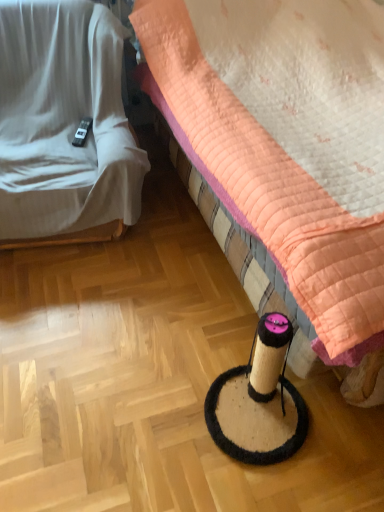
This screenshot has width=384, height=512. What do you see at coordinates (287, 137) in the screenshot?
I see `quilted peach bed at center` at bounding box center [287, 137].

Identify the location of quilted peach bed at center. (287, 137).

You are a GUI agent. You are given a task and a screenshot of the screen. Output one action in this format:
    pyautogui.click(x=<x>, y=<y>)
    Task: Click on the white fabric couch at left
    The width and height of the screenshot is (384, 512).
    Given the screenshot: What is the action you would take?
    pyautogui.click(x=64, y=123)

What do you see at coordinates (64, 123) in the screenshot?
I see `white fabric couch at left` at bounding box center [64, 123].

This screenshot has width=384, height=512. Find the location of `quilted peach bed at center`. quilted peach bed at center is located at coordinates (287, 137).

Between quilted peach bed at center and white fabric couch at left, which one appears on the right side from the viewer's perspective?

quilted peach bed at center is more to the right.

Between quilted peach bed at center and white fabric couch at left, which one is positioned in front?

quilted peach bed at center is more forward.

Is point (308, 10) closer or farther from the camera than point (59, 159)?

Clearly, point (308, 10) is more distant from the camera than point (59, 159).

From the image's perspective, which object appears higher, quilted peach bed at center or white fabric couch at left?

white fabric couch at left.

From a real-world perspective, does quilted peach bed at center stand above white fabric couch at left?

Yes, from a real-world perspective, quilted peach bed at center is on top of white fabric couch at left.

Which of these two, quilted peach bed at center or white fabric couch at left, is wider?

With larger width is quilted peach bed at center.

From their relative heights in the image, would you say quilted peach bed at center is taller or shorter than white fabric couch at left?

In the image, quilted peach bed at center appears to be taller than white fabric couch at left.

Is quilted peach bed at center bigger than white fabric couch at left?

Yes.

Is quilted peach bed at center not inside white fabric couch at left?

Indeed, quilted peach bed at center is completely outside white fabric couch at left.

Is quilted peach bed at center far from white fabric couch at left?

No, quilted peach bed at center is in close proximity to white fabric couch at left.

Is quilted peach bed at center turned away from white fabric couch at left?

No, quilted peach bed at center is not facing the opposite direction of white fabric couch at left.

What's the angular difference between quilted peach bed at center and white fabric couch at left's facing directions?

quilted peach bed at center and white fabric couch at left are facing 81.6 degrees away from each other.

What are the coordinates of `bed on the right of white fabric couch at left` in the screenshot? It's located at (287, 137).

Based on the photo, between white fabric couch at left and quilted peach bed at center, which one appears on the right side from the viewer's perspective?

quilted peach bed at center.

Considering the positions of objects white fabric couch at left and quilted peach bed at center in the image provided, who is behind, white fabric couch at left or quilted peach bed at center?

Positioned behind is white fabric couch at left.

Considering the positions of point (54, 20) and point (377, 26), is point (54, 20) closer or farther from the camera than point (377, 26)?

Point (54, 20) is positioned closer to the camera compared to point (377, 26).

From the image's perspective, between white fabric couch at left and quilted peach bed at center, which one is located above?

white fabric couch at left is shown above in the image.

From a real-world perspective, which object rests below the other?

From a 3D spatial view, white fabric couch at left is below.

Considering the sizes of objects white fabric couch at left and quilted peach bed at center in the image provided, who is wider, white fabric couch at left or quilted peach bed at center?

Wider between the two is quilted peach bed at center.

From their relative heights in the image, would you say white fabric couch at left is taller or shorter than quilted peach bed at center?

Clearly, white fabric couch at left is shorter compared to quilted peach bed at center.

Who is bigger, white fabric couch at left or quilted peach bed at center?

Bigger between the two is quilted peach bed at center.

Is quilted peach bed at center inside white fabric couch at left?

That's incorrect, quilted peach bed at center is not inside white fabric couch at left.

Is white fabric couch at left not near quilted peach bed at center?

Actually, white fabric couch at left and quilted peach bed at center are a little close together.

Is white fabric couch at left turned away from quilted peach bed at center?

No.

How many degrees apart are the facing directions of white fabric couch at left and quilted peach bed at center?

The facing directions of white fabric couch at left and quilted peach bed at center are 81.6 degrees apart.

Locate an element on the screen. The image size is (384, 512). furniture above the quilted peach bed at center (from the image's perspective) is located at coordinates (64, 123).

I want to click on furniture located underneath the quilted peach bed at center (from a real-world perspective), so click(64, 123).

The image size is (384, 512). What are the coordinates of `bed below the white fabric couch at left (from the image's perspective)` in the screenshot? It's located at (287, 137).